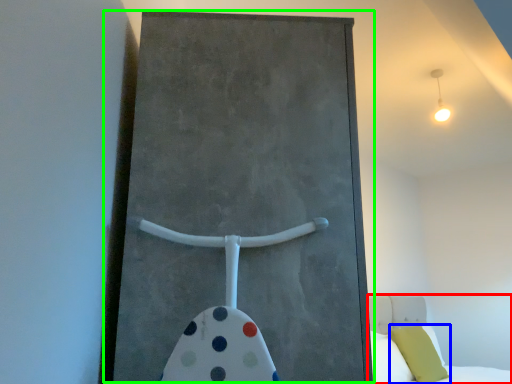
Question: Which object is positioned farthest from bed (highlighted by a red box)? Select from pillow (highlighted by a blue box) and barn door (highlighted by a green box).

Choices:
 (A) pillow
 (B) barn door

Answer: (B)